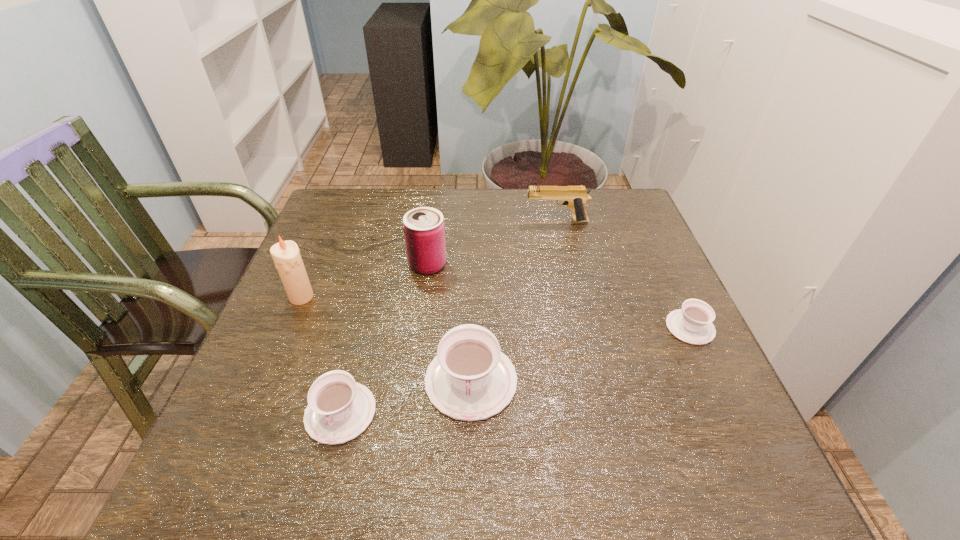
The height and width of the screenshot is (540, 960). Identify the location of free space between the fourth tallest object and the fifth object from left to right. (514, 301).

Find the location of `empty space between the second shortest object and the candle`. empty space between the second shortest object and the candle is located at coordinates (321, 355).

Locate an element on the screen. the fourth closest object to the tallest teacup is located at coordinates tap(692, 324).

Point out which object is positioned as the third nearest to the can. Please provide its 2D coordinates. Your answer should be formatted as a tuple, i.e. [(x, y)], where the tuple contains the x and y coordinates of a point satisfying the conditions above.

[(575, 197)]

The width and height of the screenshot is (960, 540). Find the location of `teacup that is the closest to the third shortest object`. teacup that is the closest to the third shortest object is located at coordinates (339, 409).

Point out which teacup is positioned as the second nearest to the can. Please provide its 2D coordinates. Your answer should be formatted as a tuple, i.e. [(x, y)], where the tuple contains the x and y coordinates of a point satisfying the conditions above.

[(339, 409)]

Identify the location of free space that satisfies the following two spatial constraints: 1. on the handle side of the shortest object; 2. at the barrel of the pistol. The width and height of the screenshot is (960, 540). (640, 221).

Find the location of a particular element. The image size is (960, 540). free point that satisfies the following two spatial constraints: 1. at the barrel of the pistol; 2. on the handle side of the shortest teacup is located at coordinates (580, 327).

This screenshot has width=960, height=540. I want to click on vacant space that satisfies the following two spatial constraints: 1. at the barrel of the second object from right to left; 2. on the handle side of the shortest object, so click(580, 327).

Find the location of a particular element. The width and height of the screenshot is (960, 540). free spot that satisfies the following two spatial constraints: 1. at the barrel of the fifth object from left to right; 2. on the handle side of the leftmost teacup is located at coordinates pyautogui.click(x=599, y=413).